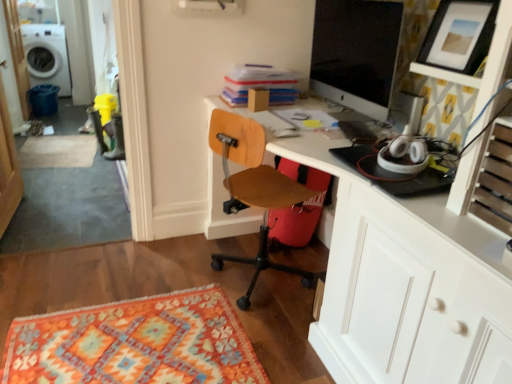
The image size is (512, 384). In order to click on free space to the right of transparent glass door at left, the 2th glass door when ordered from left to right in this screenshot , I will do `click(69, 219)`.